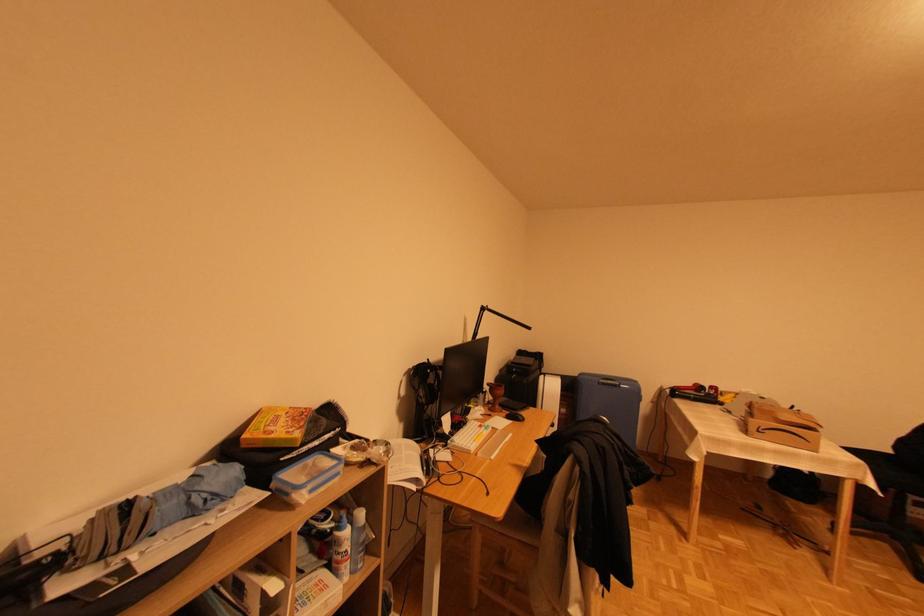
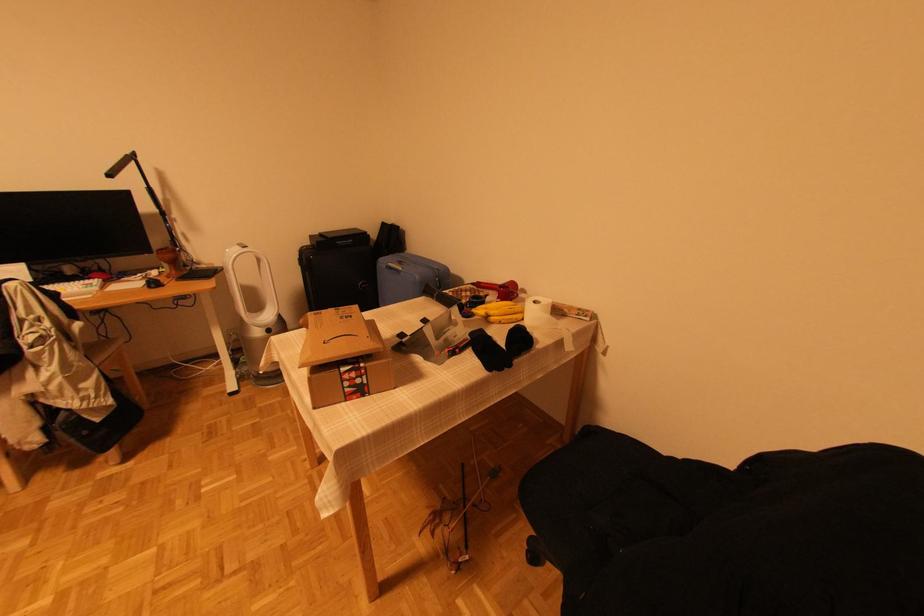
The point at (622, 384) is marked in the first image. Where is the corresponding point in the second image?

(403, 270)